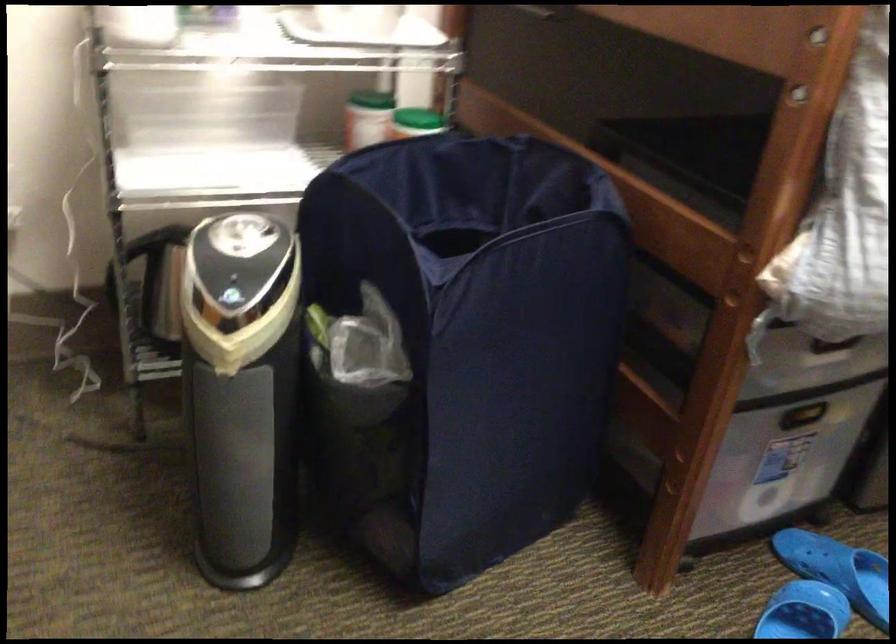
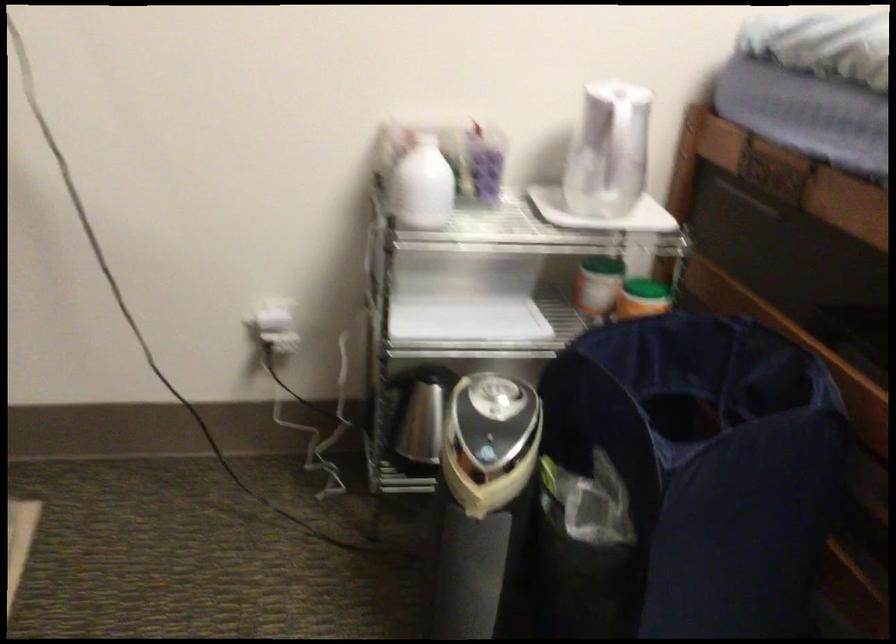
What movement of the cameraman would produce the second image?

The cameraman walked toward left, backward.